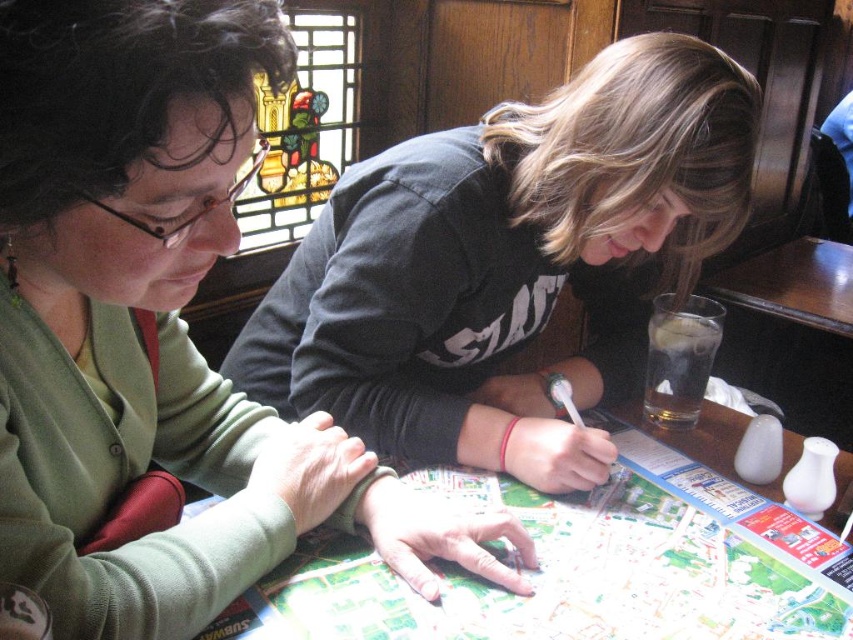
Question: Among these points, which one is farthest from the camera?

Choices:
 (A) (592, 134)
 (B) (752, 294)
 (C) (149, 166)

Answer: (B)

Question: Based on their relative distances, which object is farther from the white paper map at center?

Choices:
 (A) green matte sweater at upper left
 (B) wooden table at right

Answer: (B)

Question: Does green matte sweater at upper left appear under wooden table at right?

Choices:
 (A) no
 (B) yes

Answer: (B)

Question: Is the position of matte black shirt at center less distant than that of wooden table at right?

Choices:
 (A) no
 (B) yes

Answer: (B)

Question: Among these points, which one is nearest to the camera?

Choices:
 (A) (625, 456)
 (B) (125, 84)
 (C) (352, 406)
 (D) (796, 317)

Answer: (B)

Question: Does matte black shirt at center have a smaller size compared to white paper map at center?

Choices:
 (A) no
 (B) yes

Answer: (A)